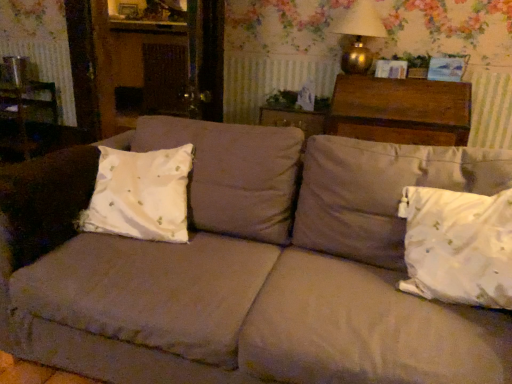
Question: From a real-world perspective, is beige fabric couch at center above or below white cotton pillow at left, which is the 1th pillow from left to right?

Choices:
 (A) below
 (B) above

Answer: (A)

Question: Visually, is beige fabric couch at center positioned to the left or to the right of white cotton pillow at left, which is the 1th pillow from left to right?

Choices:
 (A) right
 (B) left

Answer: (A)

Question: Which object is positioned closest to the white cotton pillow at left, the second pillow positioned from the right?

Choices:
 (A) gold metallic table lamp at upper right
 (B) wooden picture frame at upper center
 (C) dark brown wood chest at upper right
 (D) white satin pillow at lower right, the 2th pillow from the left
 (E) beige fabric couch at center

Answer: (E)

Question: Estimate the real-world distances between objects in this image. Which object is closer to the beige fabric couch at center?

Choices:
 (A) white cotton pillow at left, the second pillow positioned from the right
 (B) wooden picture frame at upper center
 (C) gold metallic table lamp at upper right
 (D) dark brown wood chest at upper right
 (E) white satin pillow at lower right, marked as the 1th pillow in a right-to-left arrangement

Answer: (A)